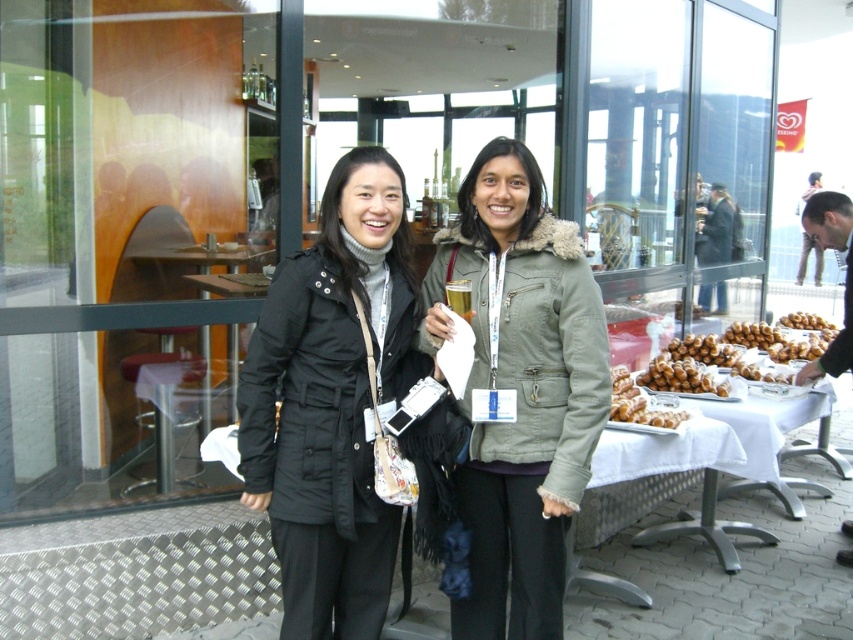
Question: Which object is farther from the camera taking this photo?

Choices:
 (A) black matte jacket at center
 (B) olive green jacket at center

Answer: (B)

Question: Can you confirm if olive green jacket at center is positioned above white cloth table at right?

Choices:
 (A) no
 (B) yes

Answer: (B)

Question: Which point appears farthest from the camera in this image?

Choices:
 (A) [750, 468]
 (B) [602, 506]
 (C) [659, 372]
 (D) [386, 154]

Answer: (B)

Question: Which point is farther to the camera?

Choices:
 (A) golden brown croissant at right
 (B) olive green jacket at center
 (C) white tablecloth at lower right

Answer: (C)

Question: Is golden brown croissant at right bigger than golden brown doughnut at right?

Choices:
 (A) no
 (B) yes

Answer: (B)

Question: Does black matte jacket at center appear over white tablecloth at lower right?

Choices:
 (A) yes
 (B) no

Answer: (A)